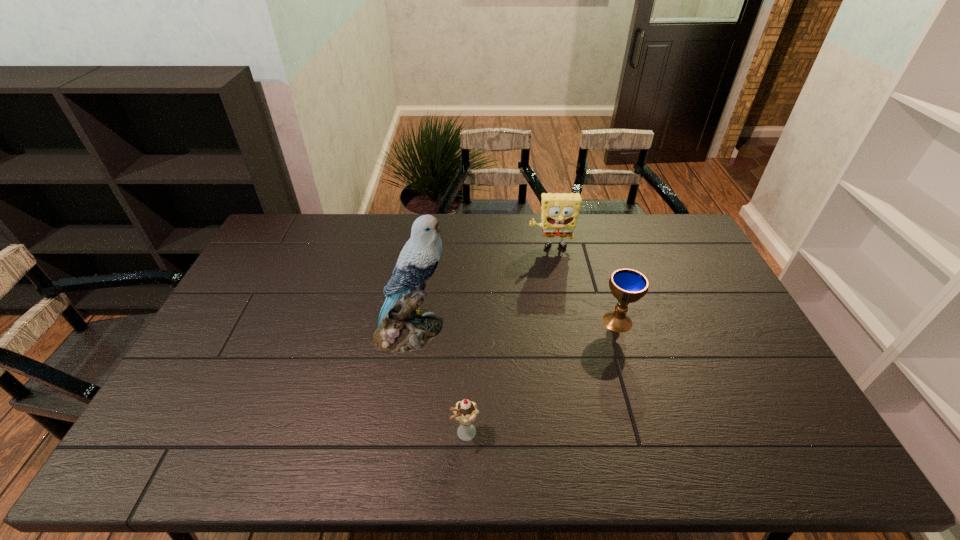
Locate an element on the screen. This screenshot has width=960, height=540. vacant space positioned 0.150m on the right of the icecream is located at coordinates pos(540,434).

This screenshot has height=540, width=960. Identify the location of object positioned at the far edge. (559, 214).

Where is `object present at the near edge`? object present at the near edge is located at coordinates (465, 412).

At what (x,y) coordinates should I click in order to perform the action: click on vacant space at the far edge of the desktop. Please return your answer as a coordinate pair (x, y). Looking at the image, I should click on (638, 244).

The image size is (960, 540). What are the coordinates of `free space at the near edge of the desktop` in the screenshot? It's located at (389, 455).

You are a GUI agent. You are given a task and a screenshot of the screen. Output one action in this format:
    pyautogui.click(x=<x>, y=<y>)
    Task: Click on the vacant space at the left edge
    The height and width of the screenshot is (540, 960).
    Given the screenshot: What is the action you would take?
    pyautogui.click(x=258, y=325)

Find the location of a particular element. The image size is (960, 540). free location at the right edge of the desktop is located at coordinates (705, 318).

Identify the location of vacant space at the far left corner of the desktop. The width and height of the screenshot is (960, 540). (274, 239).

Image resolution: width=960 pixels, height=540 pixels. Identify the location of free space at the near left corner of the desktop. (152, 455).

Identify the location of blank space at the far right corner of the desktop. (674, 247).